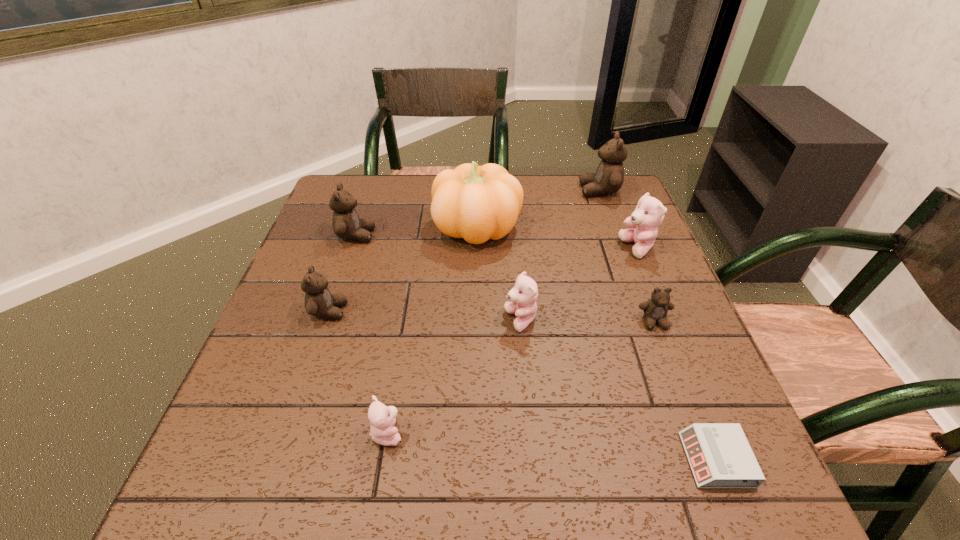
Identify the location of the nearest teddy bear. This screenshot has height=540, width=960. (382, 418).

I want to click on the nearest pink teddy bear, so (x=382, y=418).

Find the location of a particular element. The height and width of the screenshot is (540, 960). the shortest object is located at coordinates (720, 456).

Find the location of a particular element. vacant space situated 0.130m on the left of the pumpkin is located at coordinates (386, 227).

The width and height of the screenshot is (960, 540). I want to click on free space located 0.390m on the face of the farthest brown teddy bear, so click(x=452, y=191).

You are a GUI agent. You are given a task and a screenshot of the screen. Output one action in this format:
    pyautogui.click(x=<x>, y=<y>)
    Task: Click on the vacant region located on the face of the farthest brown teddy bear
    The width and height of the screenshot is (960, 540).
    Given the screenshot: What is the action you would take?
    pyautogui.click(x=452, y=191)

This screenshot has width=960, height=540. What are the coordinates of `vacant space located 0.240m on the face of the farthest brown teddy bear` in the screenshot? It's located at (501, 191).

Where is `free space located at the face of the farthest pink teddy bear`? The height and width of the screenshot is (540, 960). free space located at the face of the farthest pink teddy bear is located at coordinates (558, 248).

Image resolution: width=960 pixels, height=540 pixels. I want to click on blank space located at the face of the farthest pink teddy bear, so click(527, 248).

Identify the location of vacant region located at the face of the farthest pink teddy bear. (504, 248).